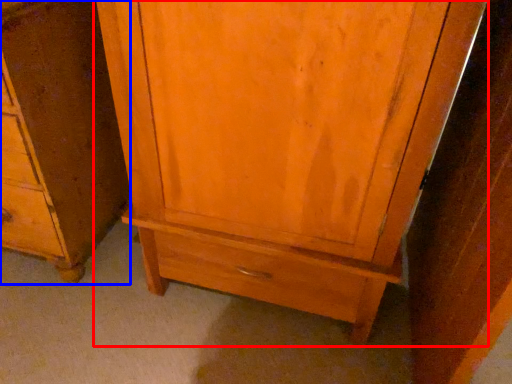
Question: Among these objects, which one is farthest to the camera, cupboard (highlighted by a red box) or chest of drawers (highlighted by a blue box)?

Choices:
 (A) cupboard
 (B) chest of drawers

Answer: (B)